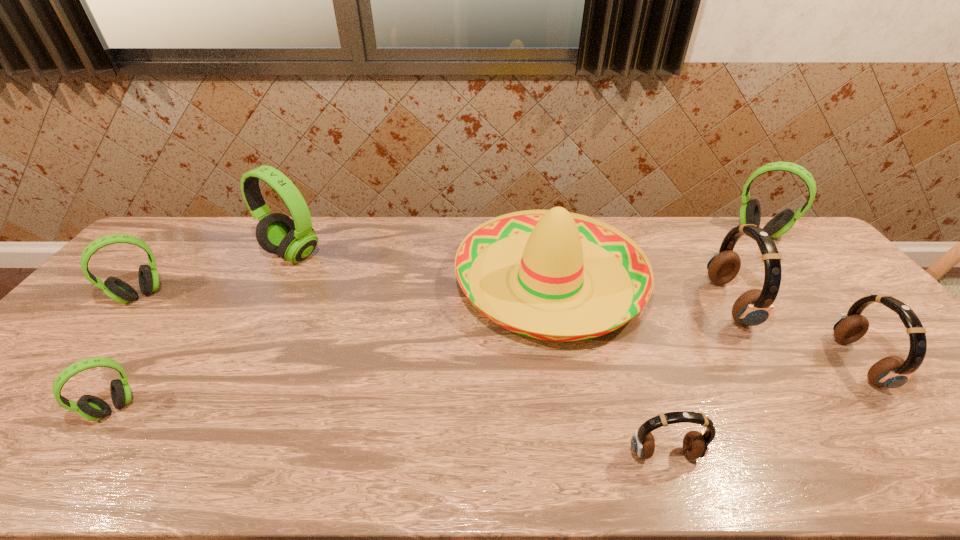
Locate an element on the screen. The height and width of the screenshot is (540, 960). vacant space at the left edge of the desktop is located at coordinates (110, 339).

Identify the location of vacant area at the right edge. The width and height of the screenshot is (960, 540). (821, 276).

Where is `free region at the far right corner`? Image resolution: width=960 pixels, height=540 pixels. free region at the far right corner is located at coordinates (793, 237).

At what (x,y) coordinates should I click in order to perform the action: click on free space between the third headset from right to left and the nearest green headset. Please return your answer as a coordinate pair (x, y). This screenshot has width=960, height=540. Looking at the image, I should click on (421, 355).

In order to click on vacant space that is in between the leftmost object and the rightmost green headset in this screenshot , I will do `click(450, 264)`.

Find the location of a particular element. vacant area that lies between the nearest green headset and the rightmost brown headset is located at coordinates (486, 386).

Locate an element on the screen. This screenshot has height=540, width=960. vacant region between the sombrero and the third farthest green headset is located at coordinates (346, 288).

The image size is (960, 540). I want to click on empty space between the smallest green headset and the second smallest green headset, so click(128, 352).

Locate an element on the screen. This screenshot has height=540, width=960. vacant area that lies between the second biggest brown headset and the third headset from right to left is located at coordinates (794, 333).

You are a GUI agent. You are given a task and a screenshot of the screen. Output one action in this format:
    pyautogui.click(x=<x>, y=<y>)
    Task: Click on the free space between the smallest green headset and the red sombrero
    
    Given the screenshot: What is the action you would take?
    pyautogui.click(x=332, y=345)